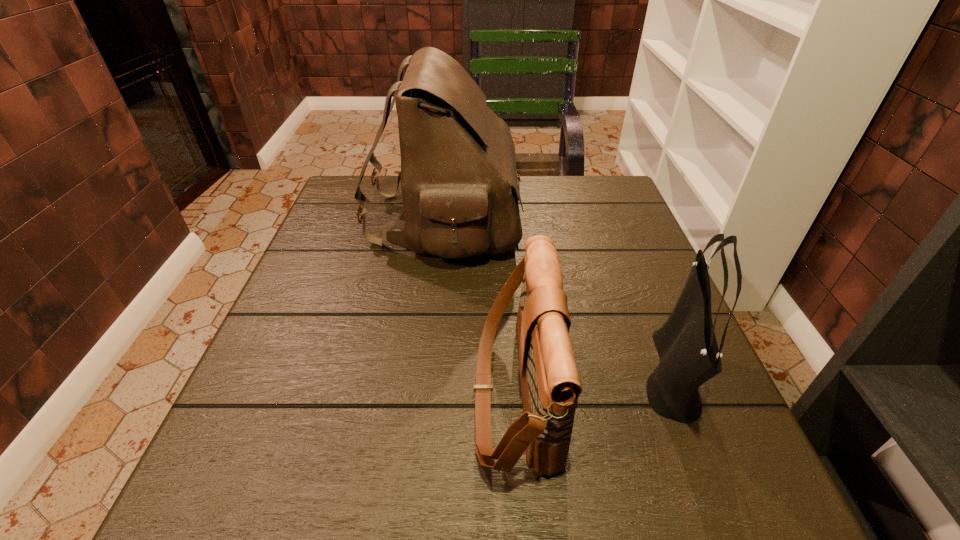
This screenshot has height=540, width=960. I want to click on free spot at the far left corner of the desktop, so click(x=336, y=214).

This screenshot has width=960, height=540. Find the location of `empty space that is in between the shorter shoulder bag and the satchel`. empty space that is in between the shorter shoulder bag and the satchel is located at coordinates (480, 307).

Identify the location of vacant area that lies between the shorter shoulder bag and the right shoulder bag. point(592,384).

At what (x,y) coordinates should I click in order to perform the action: click on vacant point located between the shorter shoulder bag and the satchel. Please return your answer as a coordinate pair (x, y). Looking at the image, I should click on (480, 307).

The width and height of the screenshot is (960, 540). What are the coordinates of `empty space that is in between the tallest object and the shortest object` in the screenshot? It's located at [x=480, y=307].

Locate an element on the screen. Image resolution: width=960 pixels, height=540 pixels. empty space that is in between the rightmost object and the shortest object is located at coordinates [592, 384].

At what (x,y) coordinates should I click in order to perform the action: click on unoccupied area between the shorter shoulder bag and the satchel. Please return your answer as a coordinate pair (x, y). Looking at the image, I should click on (480, 307).

Locate which object is the second closest to the farthest object. Please provide its 2D coordinates. Your answer should be formatted as a tuple, i.e. [(x, y)], where the tuple contains the x and y coordinates of a point satisfying the conditions above.

[(686, 344)]

Identify which object is located as the nearest to the second shortest object. Please provide its 2D coordinates. Your answer should be formatted as a tuple, i.e. [(x, y)], where the tuple contains the x and y coordinates of a point satisfying the conditions above.

[(550, 383)]

The height and width of the screenshot is (540, 960). I want to click on vacant area in the image that satisfies the following two spatial constraints: 1. on the front flap of the tallest object; 2. on the right side of the second tallest object, so click(428, 375).